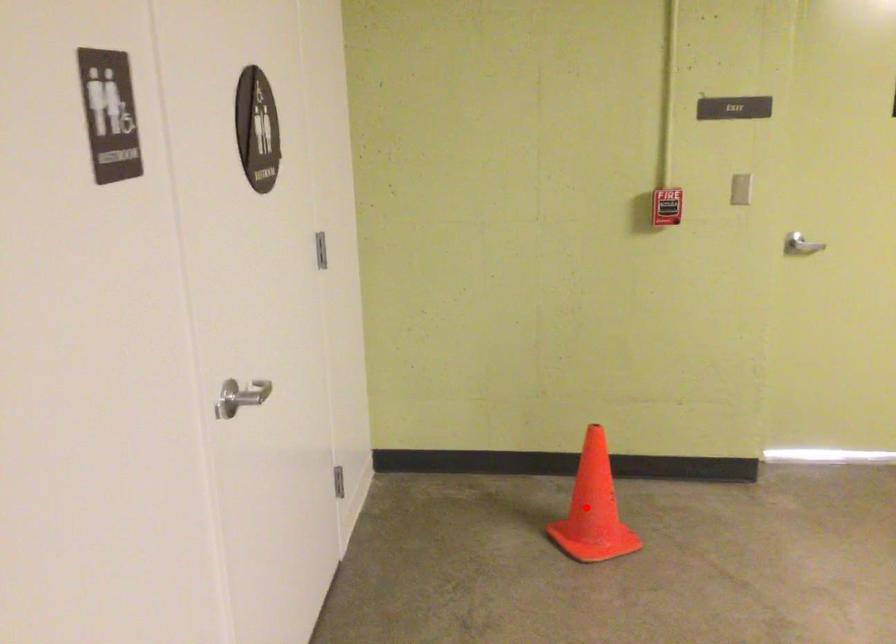
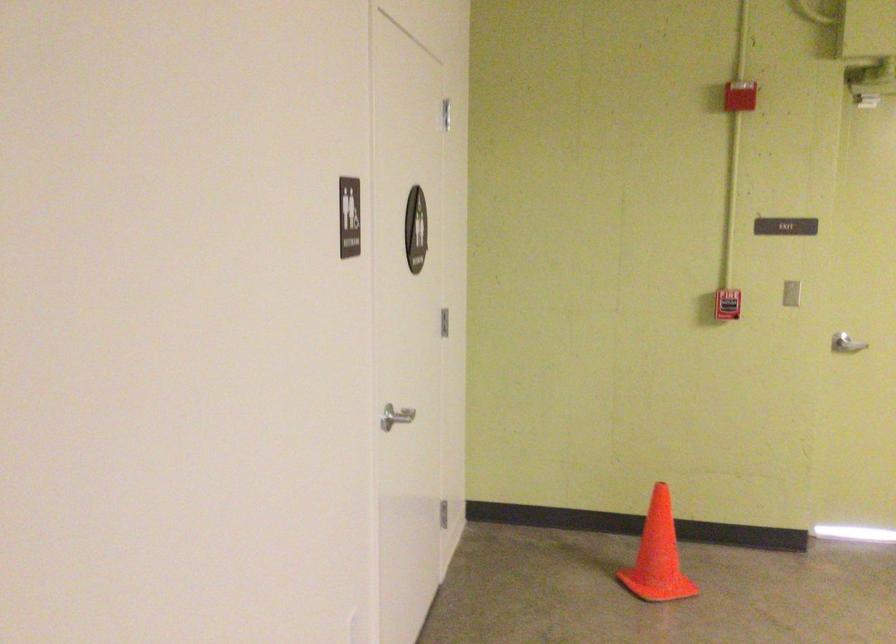
Question: I am providing you with two images of the same scene from different viewpoints. A red point is shown in image1. For the corresponding object point in image2, is it positioned nearer or farther from the camera?

Choices:
 (A) Nearer
 (B) Farther

Answer: (B)